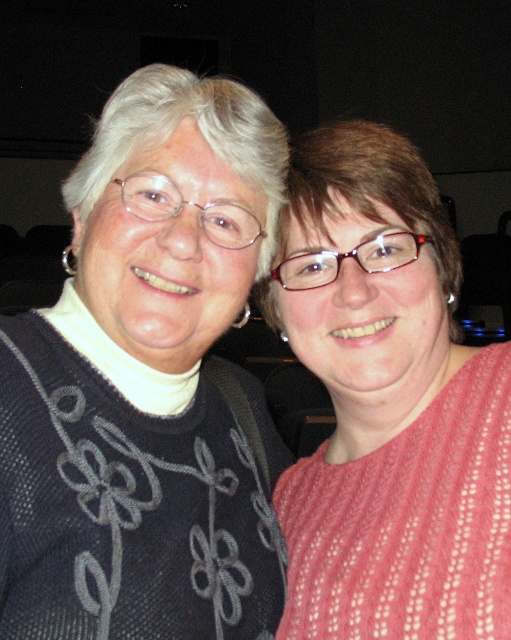
Question: Which point is farther from the camera taking this photo?

Choices:
 (A) (366, 140)
 (B) (72, 406)

Answer: (A)

Question: Among these points, which one is farthest from the camera?

Choices:
 (A) (97, 556)
 (B) (267, 291)

Answer: (B)

Question: Is dark gray knit sweater at left wider than pink knitted sweater at center?

Choices:
 (A) yes
 (B) no

Answer: (A)

Question: Does dark gray knit sweater at left have a smaller size compared to pink knitted sweater at center?

Choices:
 (A) yes
 (B) no

Answer: (B)

Question: Which of the following is the closest to the observer?

Choices:
 (A) pink knitted sweater at center
 (B) dark gray knit sweater at left

Answer: (B)

Question: Can you confirm if dark gray knit sweater at left is wider than pink knitted sweater at center?

Choices:
 (A) yes
 (B) no

Answer: (A)